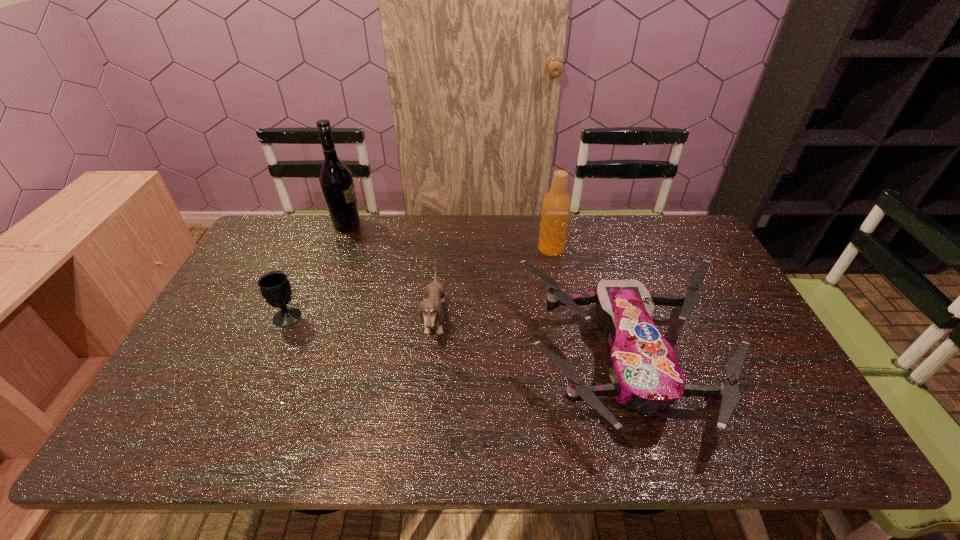
The width and height of the screenshot is (960, 540). What are the coordinates of `free space at the far left corner` in the screenshot? It's located at (289, 235).

At what (x,y) coordinates should I click in order to perform the action: click on free spot at the near right corner of the desktop. Please return your answer as a coordinate pair (x, y). Looking at the image, I should click on (773, 446).

Locate an element on the screen. The width and height of the screenshot is (960, 540). free spot between the farthest object and the drone is located at coordinates (488, 291).

I want to click on free space between the wine bottle and the drone, so click(488, 291).

Locate an element on the screen. Image resolution: width=960 pixels, height=540 pixels. free space between the chalice and the wine bottle is located at coordinates (317, 271).

Find the location of a particular element. This screenshot has width=960, height=540. vacant point located between the drone and the puppy is located at coordinates (532, 339).

Where is `free spot between the tallest object and the puppy`? The width and height of the screenshot is (960, 540). free spot between the tallest object and the puppy is located at coordinates (391, 272).

Image resolution: width=960 pixels, height=540 pixels. Identify the location of free spot between the third object from left to right and the drone. (532, 339).

Locate an element on the screen. The height and width of the screenshot is (540, 960). vacant area between the puppy and the drone is located at coordinates (532, 339).

In order to click on vacant area that lies between the farthest object and the chalice in this screenshot , I will do `click(317, 271)`.